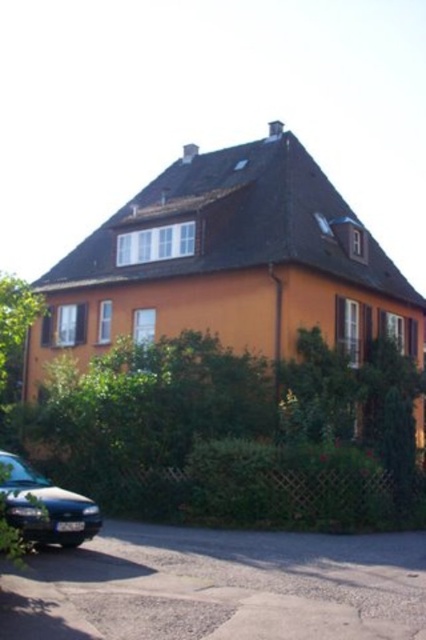
Does green leafy hedge at center have a larger size compared to shiny black sedan at lower left?

Correct, green leafy hedge at center is larger in size than shiny black sedan at lower left.

Which of these two, green leafy hedge at center or shiny black sedan at lower left, stands taller?

green leafy hedge at center

Between point (319, 390) and point (63, 545), which one is positioned behind?

The point (319, 390) is more distant.

At what (x,y) coordinates should I click in order to perform the action: click on green leafy hedge at center. Please return your answer as a coordinate pair (x, y). Looking at the image, I should click on (230, 435).

Can you confirm if green leafy hedge at center is shorter than gray asphalt driveway at lower left?

In fact, green leafy hedge at center may be taller than gray asphalt driveway at lower left.

Can you confirm if green leafy hedge at center is bigger than gray asphalt driveway at lower left?

Correct, green leafy hedge at center is larger in size than gray asphalt driveway at lower left.

This screenshot has height=640, width=426. I want to click on green leafy hedge at center, so click(230, 435).

This screenshot has height=640, width=426. In order to click on green leafy hedge at center in this screenshot , I will do `click(230, 435)`.

Can you confirm if gray asphalt driveway at lower left is positioned above shiny black sedan at lower left?

Incorrect, gray asphalt driveway at lower left is not positioned above shiny black sedan at lower left.

At what (x,y) coordinates should I click in order to perform the action: click on gray asphalt driveway at lower left. Please return your answer as a coordinate pair (x, y). This screenshot has width=426, height=640. Looking at the image, I should click on (224, 586).